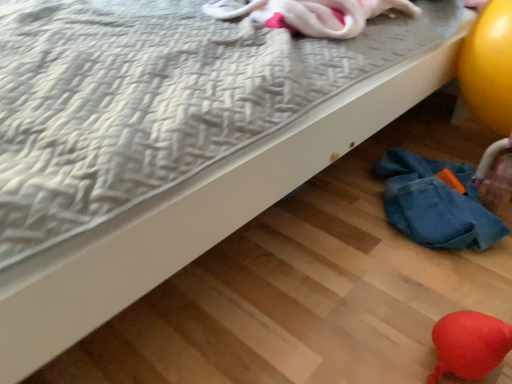
Find the location of a particular element. The image size is (512, 384). rubberized red balloon at lower right is located at coordinates (469, 345).

The width and height of the screenshot is (512, 384). Describe the element at coordinates (469, 345) in the screenshot. I see `rubberized red balloon at lower right` at that location.

At what (x,y) coordinates should I click in order to perform the action: click on rubberized red balloon at lower right. Please return your answer as a coordinate pair (x, y). Looking at the image, I should click on (469, 345).